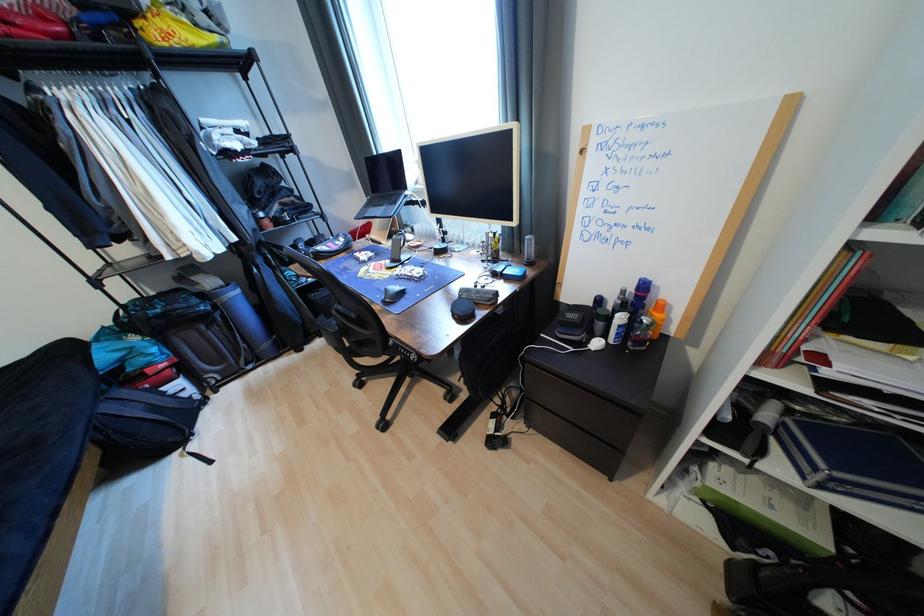
Find the location of a particular element. black computer mouse is located at coordinates (393, 293).